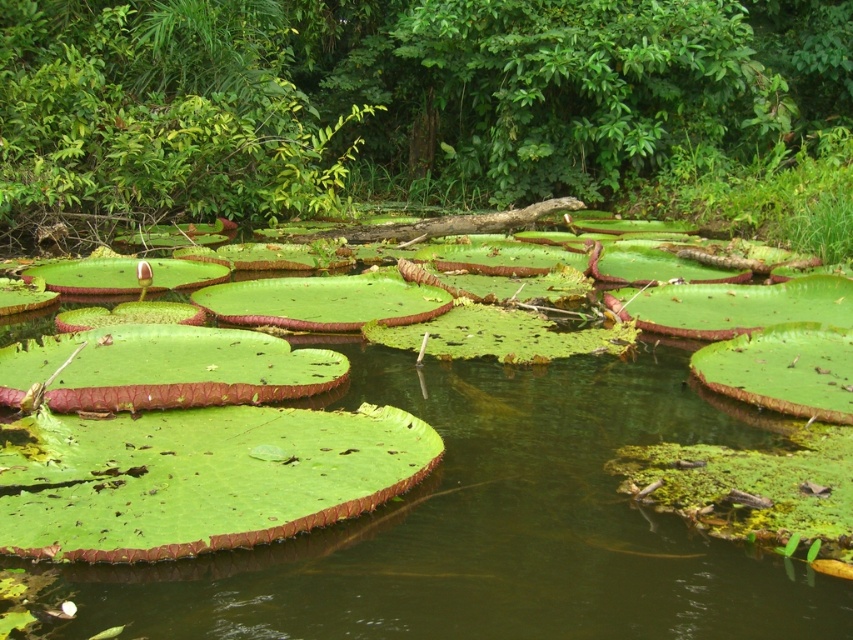
Is point (107, 100) behind point (524, 528)?

Yes.

Does green leathery leaves at center appear over green leafy water at center?

Yes, green leathery leaves at center is above green leafy water at center.

Describe the element at coordinates (427, 109) in the screenshot. I see `green leathery leaves at center` at that location.

The width and height of the screenshot is (853, 640). I want to click on green leathery leaves at center, so click(427, 109).